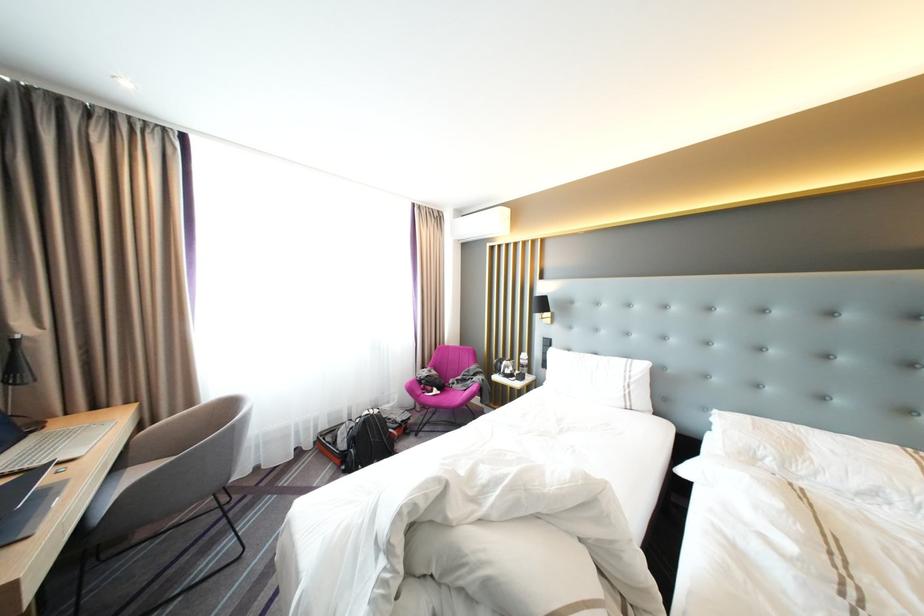
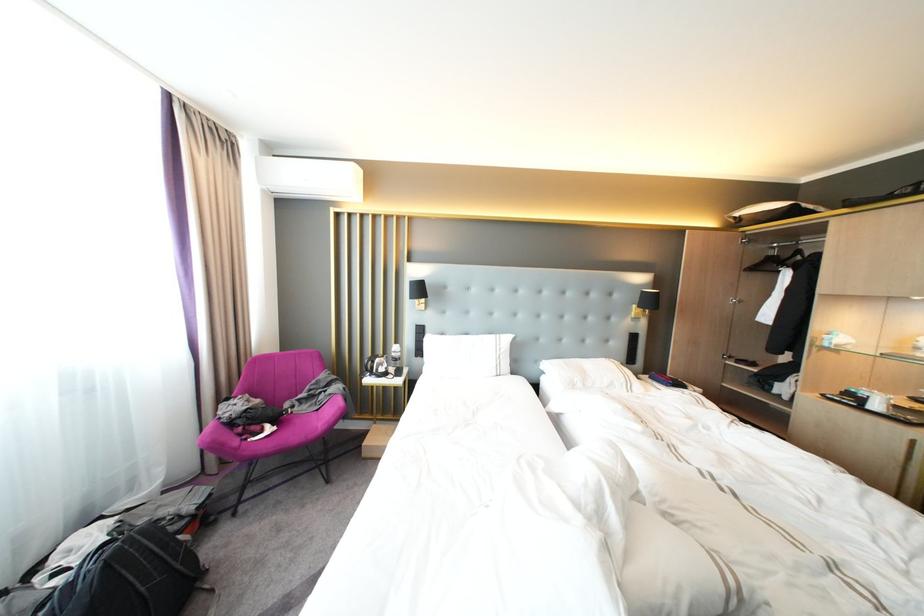
Question: Based on the continuous images, in which direction is the camera rotating? Reply with the corresponding letter.

Choices:
 (A) Left
 (B) Right
 (C) Up
 (D) Down

Answer: (B)